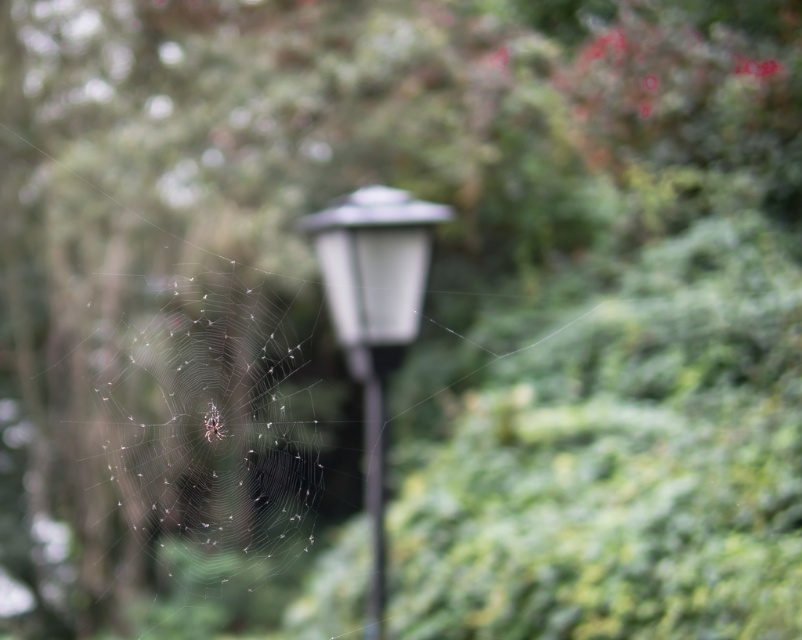
You are standing in the outdoor scene and see a point at coordinates (375, 317). Which object is this point located on?

The point at coordinates (375, 317) is located on the white glossy street light at center.

You are a photographer aiming to capture the spiderweb without the lamppost being visible in the shot. Based on the scene, can you position yourself in a way that the translucent silk web at center obscures the black glass pole at center?

Yes, the translucent silk web at center is positioned over the black glass pole at center, so positioning the camera behind the web would allow it to block the view of the pole.

You are a photographer trying to capture the translucent silk spider at center and the translucent silk web at center in a single shot. Based on their positions, will the spider be in focus if the web is in focus?

The translucent silk web at center is above the translucent silk spider at center. Since they are at different heights, focusing on one may cause the other to be slightly out of focus depending on the camera settings. However, if the depth of field is sufficient, both could be in focus.